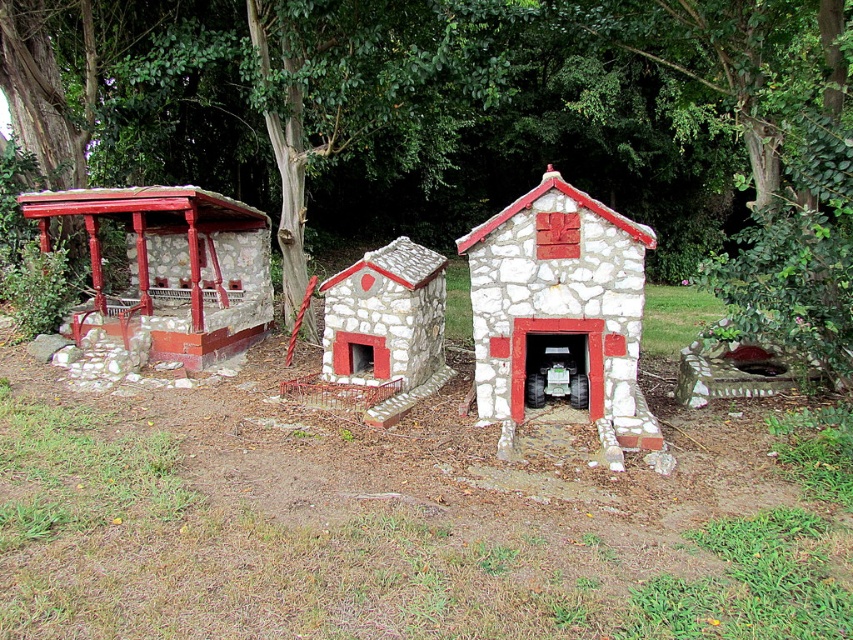
Question: Which point appears closest to the camera in this image?

Choices:
 (A) (822, 278)
 (B) (337, 298)
 (C) (183, 227)

Answer: (A)

Question: Can you confirm if white stone fireplace at center is wider than brushed metal gazebo at left?

Choices:
 (A) no
 (B) yes

Answer: (A)

Question: Which of these objects is positioned farthest from the green leafy tree at upper center?

Choices:
 (A) stone/redobject at center
 (B) white stone fireplace at center
 (C) brushed metal gazebo at left

Answer: (A)

Question: Is brushed metal gazebo at left closer to camera compared to stone/redobject at center?

Choices:
 (A) yes
 (B) no

Answer: (B)

Question: Is brushed metal gazebo at left behind stone/redobject at center?

Choices:
 (A) yes
 (B) no

Answer: (A)

Question: Which object appears farthest from the camera in this image?

Choices:
 (A) brushed metal gazebo at left
 (B) white stone fireplace at center
 (C) green leafy tree at upper center
 (D) stone/redobject at center

Answer: (A)